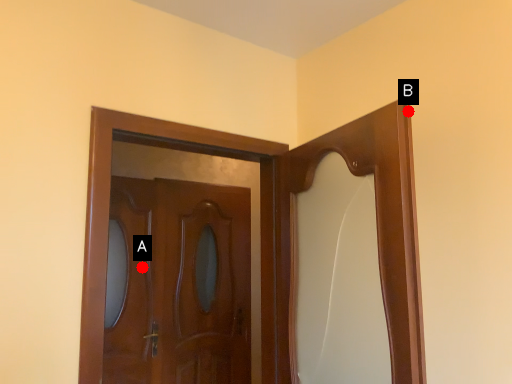
Question: Two points are circled on the image, labeled by A and B beside each circle. Which point is closer to the camera?

Choices:
 (A) A is closer
 (B) B is closer

Answer: (B)